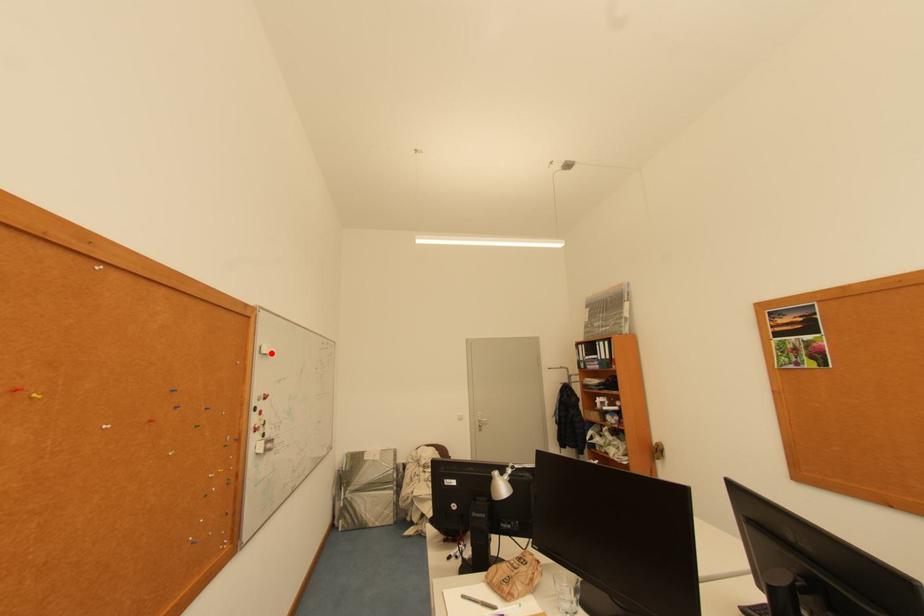
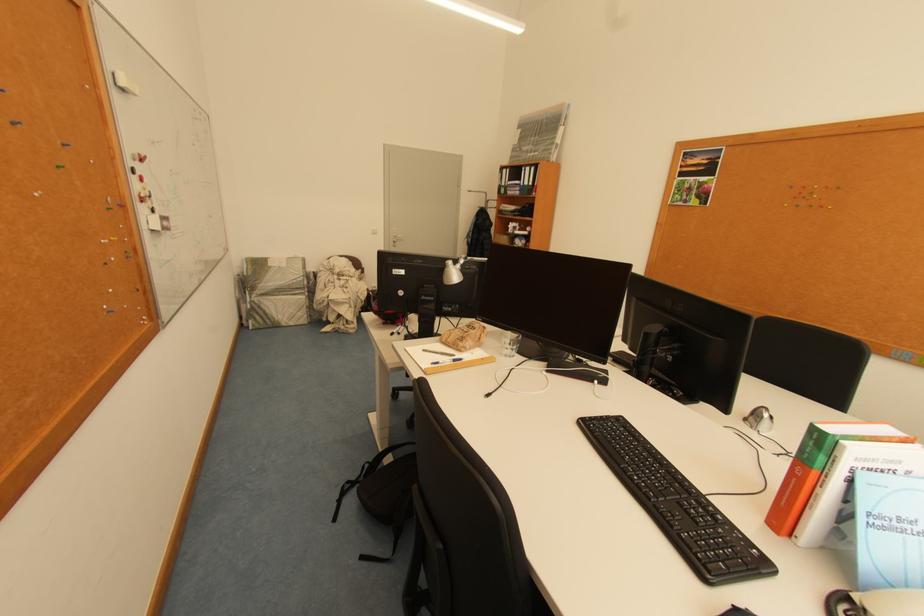
The point at the highlighted location is marked in the first image. Where is the corresponding point in the second image?

(129, 84)